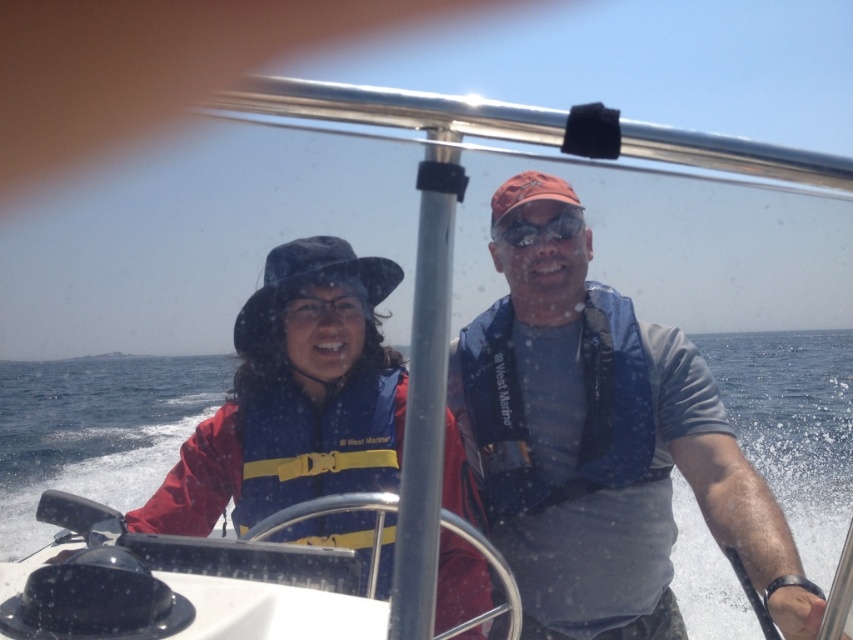
Question: Is blue fabric life vest at center below blue life vest at center?

Choices:
 (A) no
 (B) yes

Answer: (B)

Question: Which of the following is the farthest from the observer?

Choices:
 (A) (395, 378)
 (B) (523, 243)
 (C) (670, 346)

Answer: (A)

Question: Can you confirm if blue fabric life vest at center is positioned above blue life vest at center?

Choices:
 (A) yes
 (B) no

Answer: (B)

Question: Which point is closer to the camera taking this photo?

Choices:
 (A) (508, 358)
 (B) (283, 369)

Answer: (B)

Question: Which point is farther from the camera taking this photo?

Choices:
 (A) (368, 432)
 (B) (456, 413)
 (C) (524, 220)

Answer: (B)

Question: Is blue fabric life vest at center wider than matte black goggles at center?

Choices:
 (A) no
 (B) yes

Answer: (B)